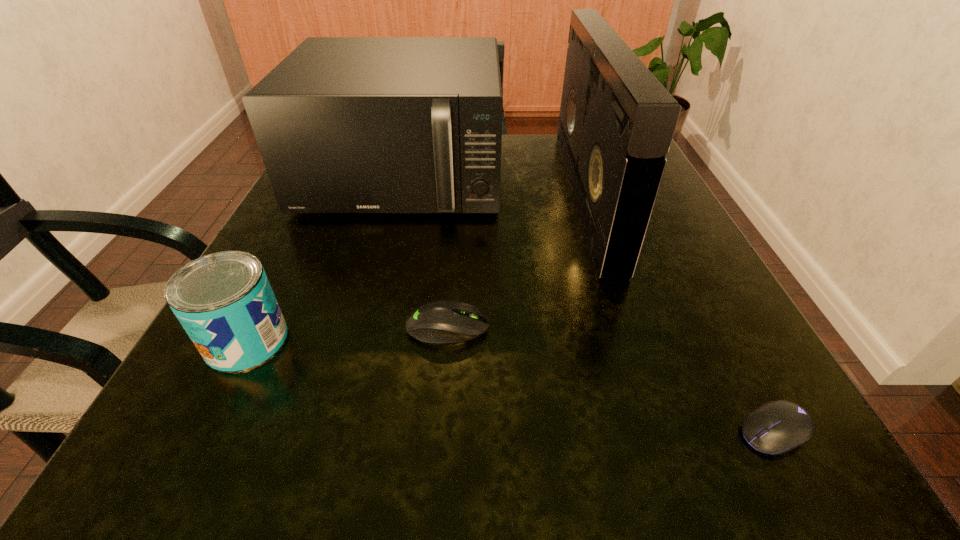
Locate an element on the screen. This screenshot has height=540, width=960. blank space located 0.220m on the front side of the fourth object from left to right is located at coordinates (463, 196).

Identify the location of vacant region located 0.080m on the front-facing side of the microwave oven. The height and width of the screenshot is (540, 960). (382, 255).

This screenshot has height=540, width=960. I want to click on vacant space located 0.210m on the back of the can, so click(x=303, y=228).

Find the location of a particular element. The width and height of the screenshot is (960, 540). free location located on the wheel side of the farther computer mouse is located at coordinates (659, 327).

Where is `vacant space situated on the back of the nearer computer mouse`? vacant space situated on the back of the nearer computer mouse is located at coordinates [x=727, y=342].

This screenshot has height=540, width=960. I want to click on videotape that is at the far edge, so click(x=616, y=124).

Image resolution: width=960 pixels, height=540 pixels. Find the location of `microwave oven at the far edge`. microwave oven at the far edge is located at coordinates (344, 124).

Where is `object at the near edge`? The width and height of the screenshot is (960, 540). object at the near edge is located at coordinates (777, 427).

Identify the location of microwave oven located in the left edge section of the desktop. Image resolution: width=960 pixels, height=540 pixels. (344, 124).

This screenshot has width=960, height=540. I want to click on can that is at the left edge, so click(x=224, y=301).